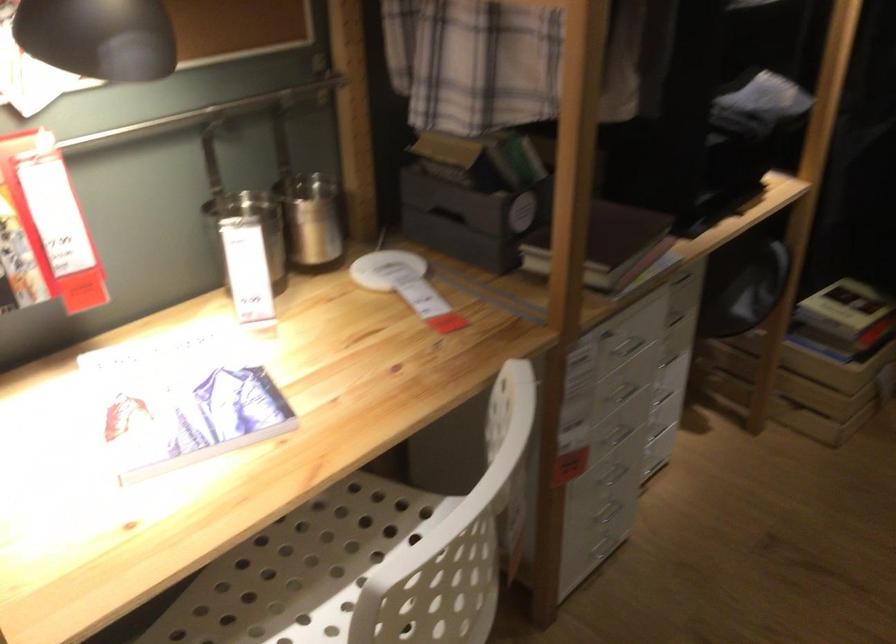
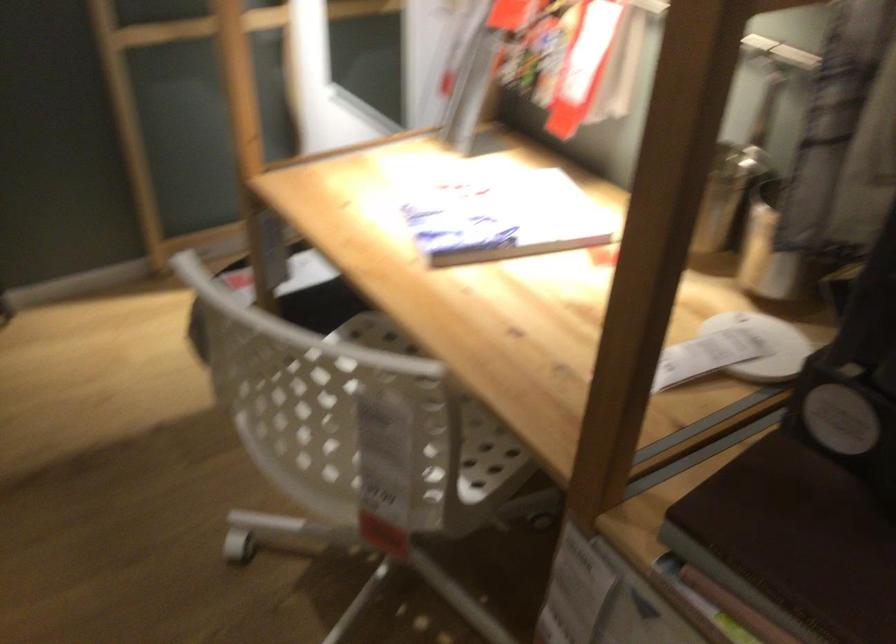
Find the pixel in the second image that matches point (616, 238) in the first image.

(793, 542)